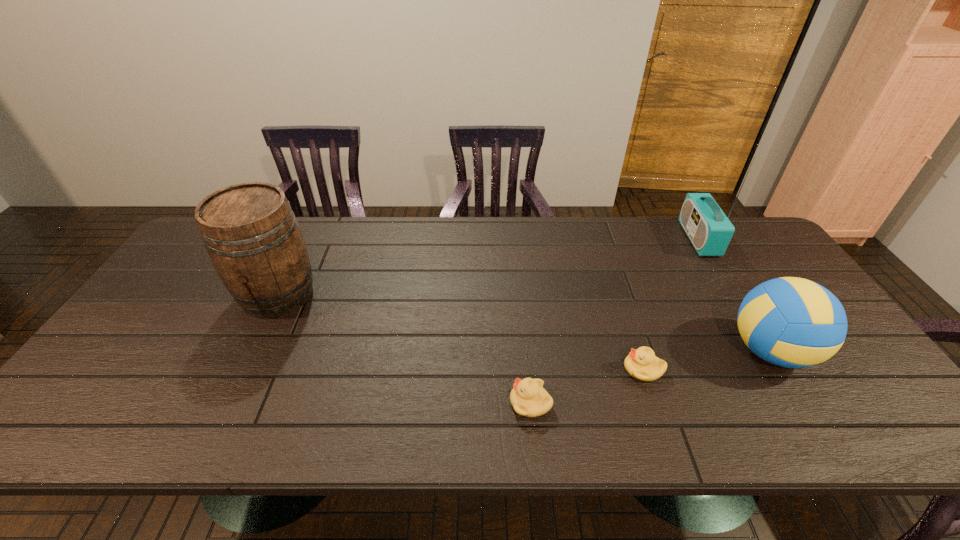
Image resolution: width=960 pixels, height=540 pixels. I want to click on object situated at the far right corner, so click(708, 228).

Find the location of `vacant space at the far edge of the desktop`. vacant space at the far edge of the desktop is located at coordinates (377, 261).

At what (x,y) coordinates should I click in order to perform the action: click on free region at the near edge. Please return your answer as a coordinate pair (x, y). The height and width of the screenshot is (540, 960). Looking at the image, I should click on (285, 422).

The width and height of the screenshot is (960, 540). I want to click on free space at the left edge of the desktop, so click(x=100, y=379).

Locate an element on the screen. This screenshot has width=960, height=540. free space between the cider and the volleyball is located at coordinates (524, 323).

You are a GUI agent. You are given a task and a screenshot of the screen. Output one action in this format:
    pyautogui.click(x=<x>, y=<y>)
    Task: Click on the vacant space that's between the farthest object and the third shortest object
    
    Given the screenshot: What is the action you would take?
    pyautogui.click(x=734, y=295)

At what (x,y) coordinates should I click in order to perform the action: click on free space between the farthest object and the cider. Please return your answer as a coordinate pair (x, y). Image resolution: width=960 pixels, height=540 pixels. Looking at the image, I should click on (489, 267).

Find the location of a particular element. This screenshot has width=960, height=540. vacant space that is in between the cider and the volleyball is located at coordinates (524, 323).

Locate an element on the screen. vacant space that's between the third object from left to right and the radio receiver is located at coordinates (671, 303).

Locate an element on the screen. This screenshot has width=960, height=540. free space between the cider and the volleyball is located at coordinates (524, 323).